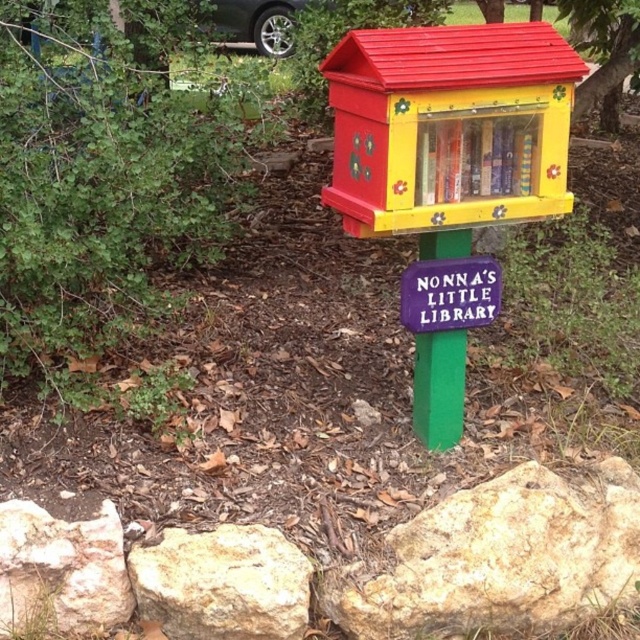
Is wooden painted bird feeder at center in front of purple matte sign at center?

Yes, it is in front of purple matte sign at center.

Where is `wooden painted bird feeder at center`? The image size is (640, 640). wooden painted bird feeder at center is located at coordinates (449, 129).

Where is `wooden painted bird feeder at center`? wooden painted bird feeder at center is located at coordinates (449, 129).

Between point (552, 576) and point (589, 52), which one is positioned in front?

Point (552, 576) is more forward.

What are the coordinates of `smooth beige rock at lower right` in the screenshot? It's located at (502, 557).

Based on the photo, does wooden painted bird feeder at center have a greater width compared to white rough rock at lower left?

Indeed, wooden painted bird feeder at center has a greater width compared to white rough rock at lower left.

Between wooden painted bird feeder at center and white rough rock at lower left, which one has less height?

With less height is white rough rock at lower left.

Is point (340, 42) farther from viewer compared to point (93, 611)?

Yes, it is behind point (93, 611).

Locate an element on the screen. The width and height of the screenshot is (640, 640). wooden painted bird feeder at center is located at coordinates (449, 129).